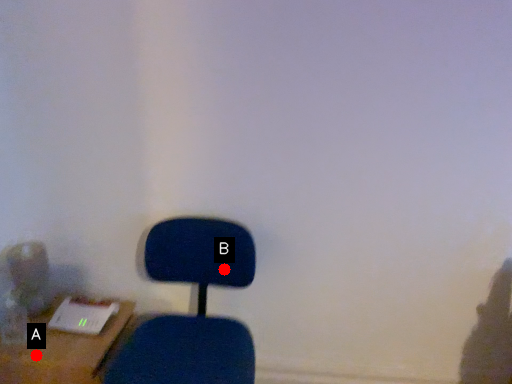
Question: Two points are circled on the image, labeled by A and B beside each circle. Which point is further to the camera?

Choices:
 (A) A is further
 (B) B is further

Answer: (B)